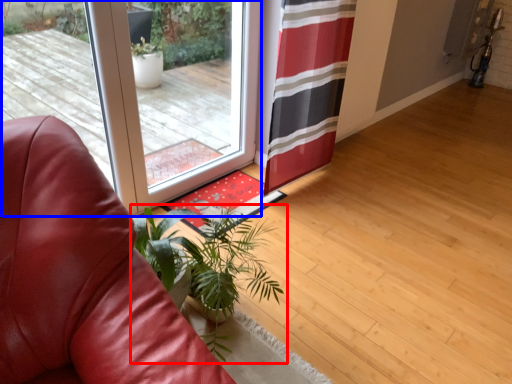
Question: Which of the following is the closest to the observer, houseplant (highlighted by a red box) or door (highlighted by a blue box)?

Choices:
 (A) houseplant
 (B) door

Answer: (A)